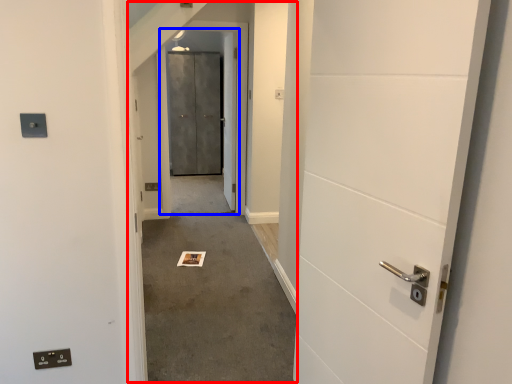
Question: Which of the following is the closest to the observer, corridor (highlighted by a red box) or elevator door (highlighted by a blue box)?

Choices:
 (A) corridor
 (B) elevator door

Answer: (A)